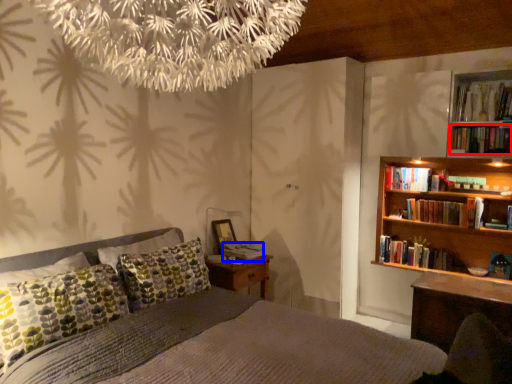
Question: Which of the following is the closest to the observer, book (highlighted by a red box) or book (highlighted by a blue box)?

Choices:
 (A) book
 (B) book

Answer: (A)